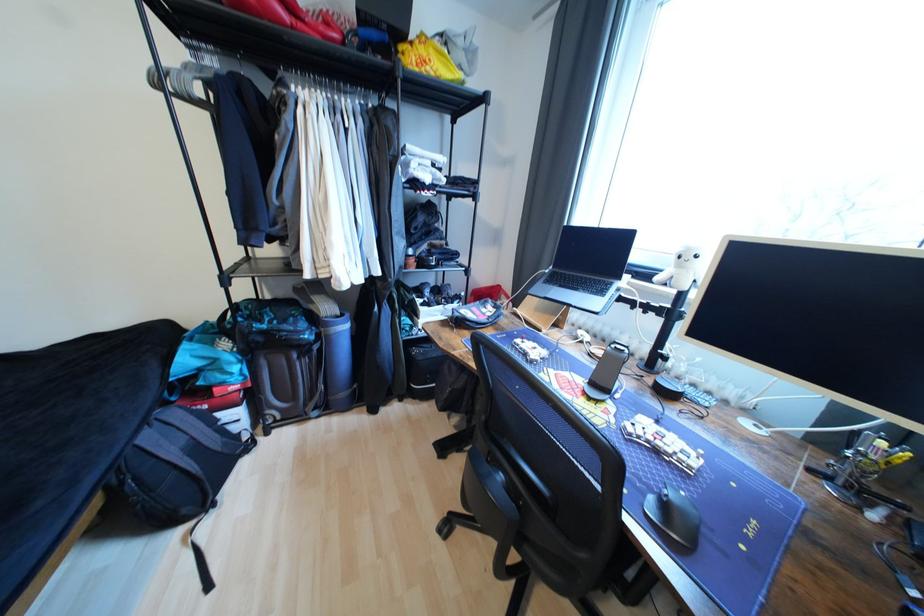
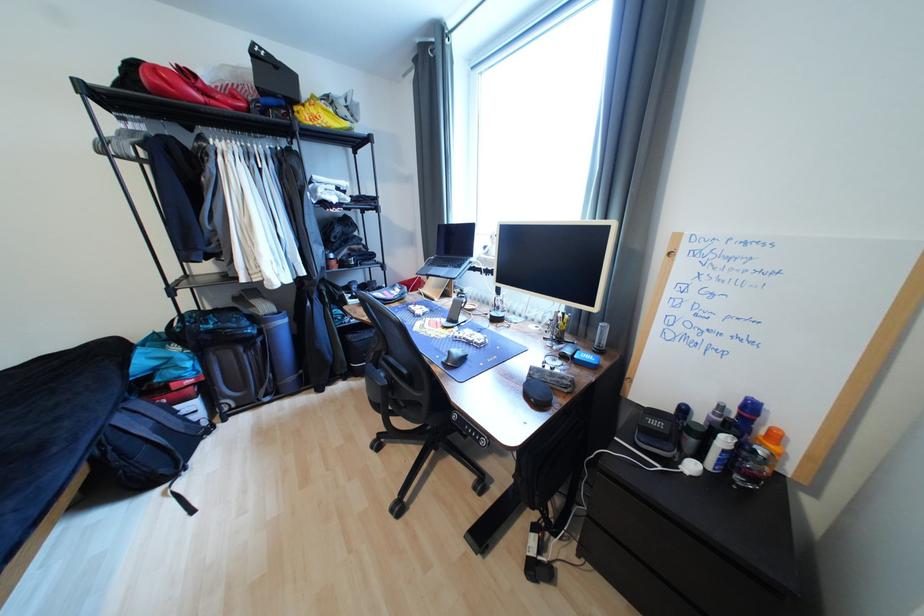
The images are taken continuously from a first-person perspective. In which direction are you moving?

The cameraman moved toward right, backward.